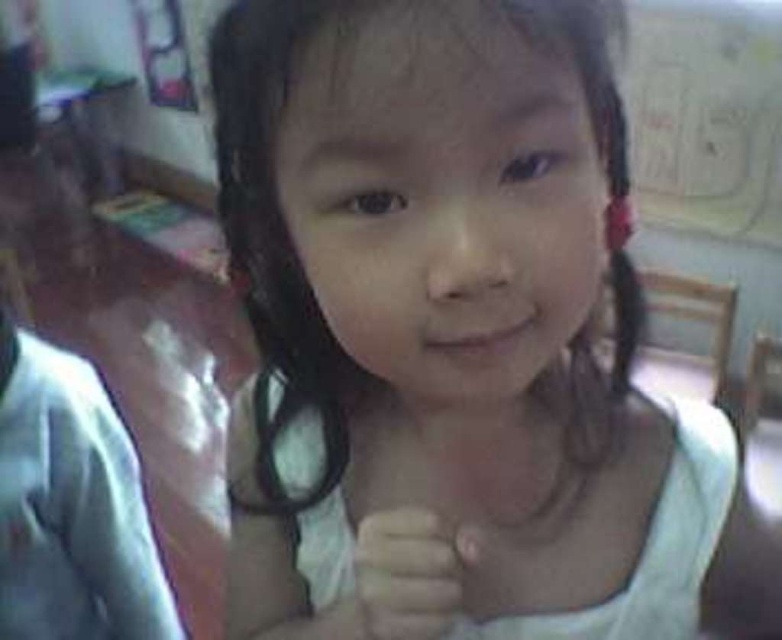
Question: Can you confirm if white fabric child at center is wider than white fabric dress at center?

Choices:
 (A) no
 (B) yes

Answer: (B)

Question: Does white fabric child at center have a smaller size compared to white matte hand at center?

Choices:
 (A) no
 (B) yes

Answer: (A)

Question: Which point is farther to the camera?

Choices:
 (A) white fabric child at center
 (B) white fabric dress at center

Answer: (B)

Question: Does white fabric dress at center have a greater width compared to white matte hand at center?

Choices:
 (A) no
 (B) yes

Answer: (B)

Question: Which object is farther from the camera taking this photo?

Choices:
 (A) white fabric dress at center
 (B) white matte hand at center
 (C) white fabric child at center

Answer: (A)

Question: Among these points, which one is nearest to the camera?

Choices:
 (A) (370, 529)
 (B) (275, 97)
 (C) (576, 624)

Answer: (B)